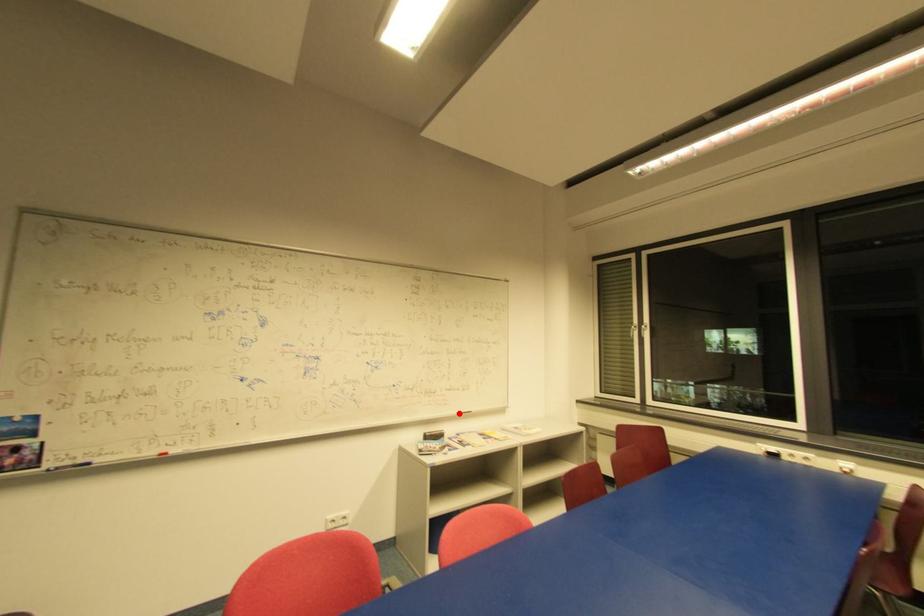
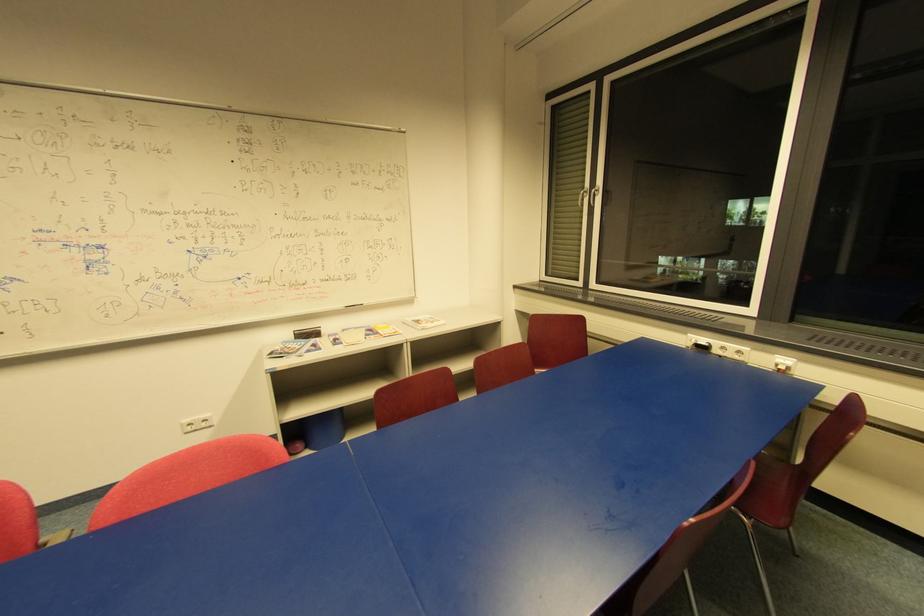
Question: I am providing you with two images of the same scene from different viewpoints. Image1 has a red point marked. In image2, the corresponding 3D location appears at what relative position? Reply with the corresponding letter.

Choices:
 (A) Closer
 (B) Farther

Answer: (A)